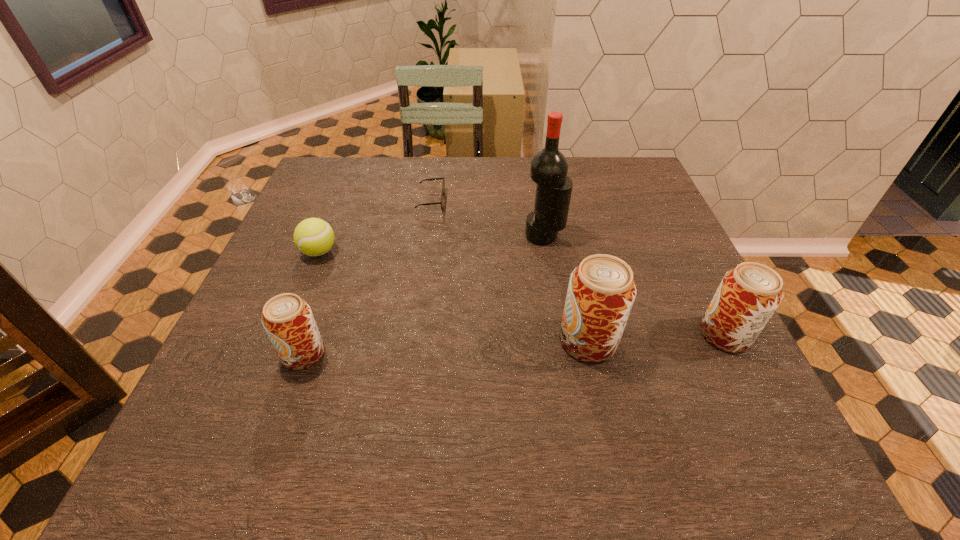
At what (x,y) coordinates should I click in order to perform the action: click on free space in the image that satisfies the following two spatial constraints: 1. on the front-facing side of the rightmost beer can; 2. on the right side of the shortest object. Please return your answer as a coordinate pair (x, y). The image size is (960, 540). Looking at the image, I should click on (412, 335).

At what (x,y) coordinates should I click in order to perform the action: click on vacant region that satisfies the following two spatial constraints: 1. on the front-facing side of the second beer can from right to left; 2. on the right side of the shortest object. Please return your answer as a coordinate pair (x, y). The width and height of the screenshot is (960, 540). Looking at the image, I should click on (411, 341).

Identify the location of free space that satisfies the following two spatial constraints: 1. on the front-facing side of the sunglasses; 2. on the left side of the second shortest beer can. This screenshot has width=960, height=540. (412, 335).